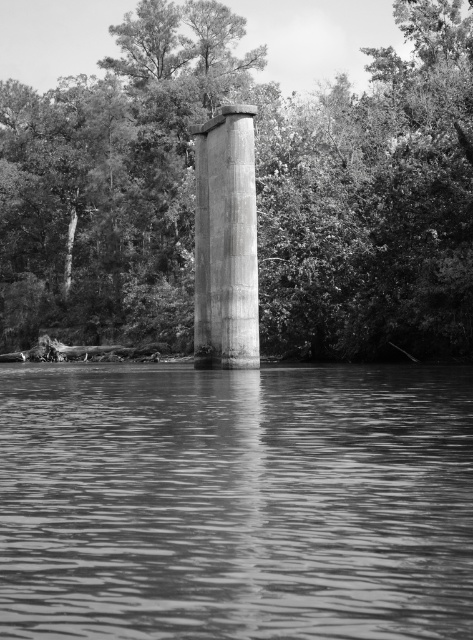
You are a photographer trying to capture the smooth green tree at center and the smooth water at center. If you want to frame both objects in a single shot, which one should you position on the left side of your camera frame?

The smooth green tree at center should be positioned on the left side of your camera frame because it is already located on the left side of the smooth water at center in the scene.

You are a photographer trying to capture the smooth green tree at center and the smooth water at center in a single frame. Based on their sizes, which object should you focus on first to ensure both fit in the composition?

The smooth green tree at center is larger than the smooth water at center, so you should focus on the smooth green tree at center first to ensure it fits properly in the composition.